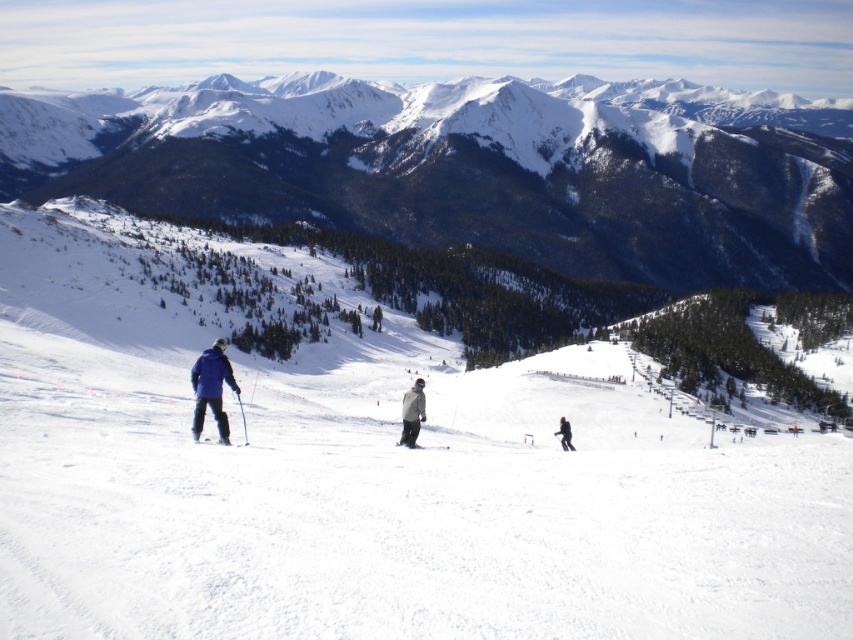
Which is below, snowy rocky mountains at upper center or black matte ski at center?

black matte ski at center is lower down.

Can you confirm if snowy rocky mountains at upper center is smaller than black matte ski at center?

Actually, snowy rocky mountains at upper center might be larger than black matte ski at center.

Locate an element on the screen. snowy rocky mountains at upper center is located at coordinates (476, 168).

Is point (199, 408) closer to viewer compared to point (199, 442)?

No, (199, 408) is further to viewer.

Between matte blue jacket at left and matte blue ski at lower left, which one has more height?

Standing taller between the two is matte blue jacket at left.

Where is `matte blue jacket at left`? This screenshot has width=853, height=640. matte blue jacket at left is located at coordinates (212, 388).

Is the position of black matte jacket at center less distant than that of matte blue ski at lower left?

No.

Is black matte jacket at center further to camera compared to matte blue ski at lower left?

Yes, black matte jacket at center is behind matte blue ski at lower left.

This screenshot has height=640, width=853. I want to click on black matte jacket at center, so point(564,435).